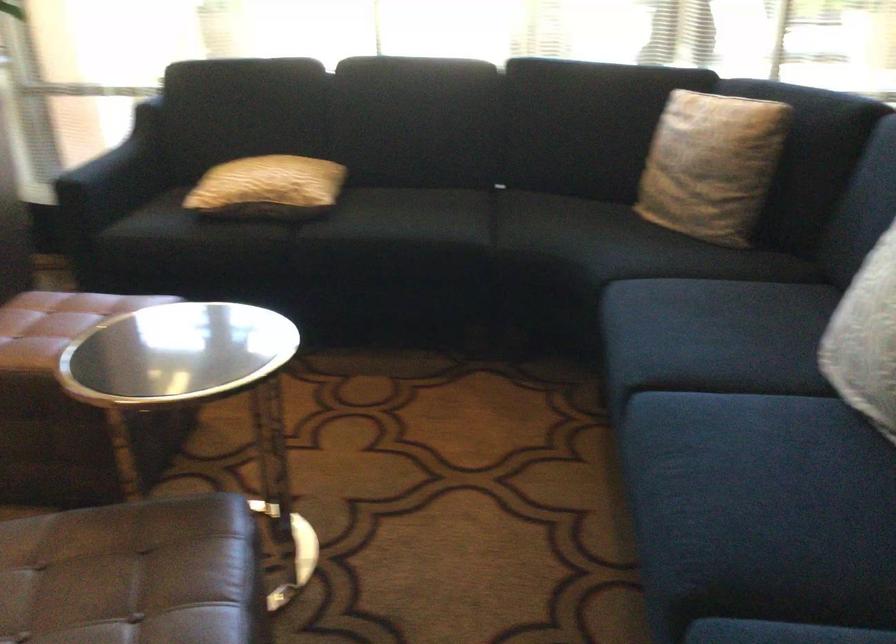
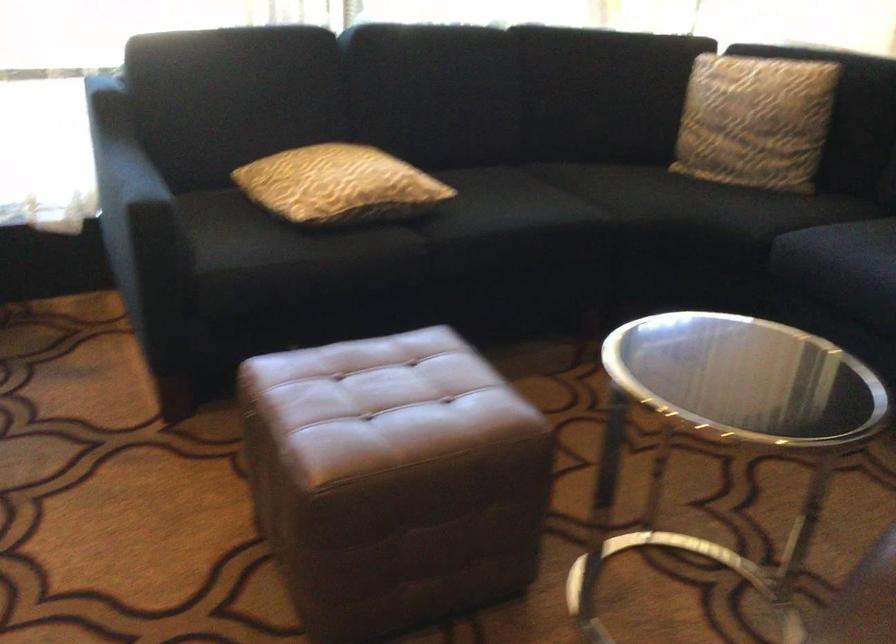
Where in the second image is the point corresponding to [313,227] from the first image?

(426, 227)